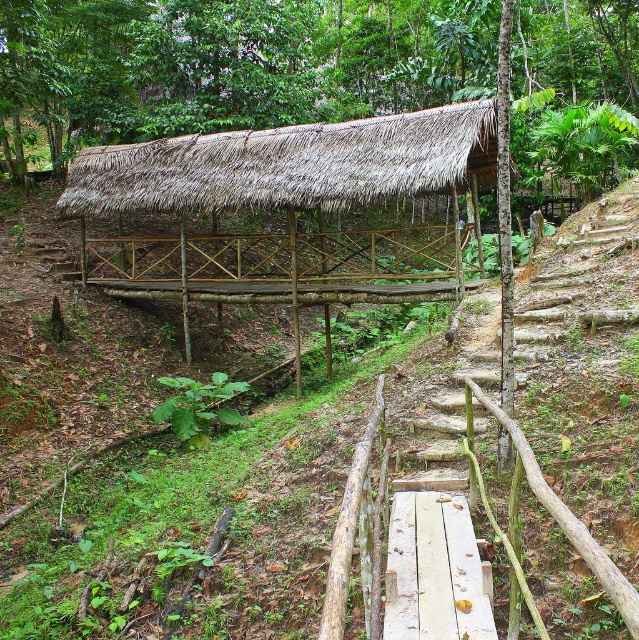
Can you confirm if thatched roof hut at upper center is taller than thatched roof shelter at center?

Correct, thatched roof hut at upper center is much taller as thatched roof shelter at center.

Is point (344, 8) positioned before point (252, 132)?

No.

Between point (107, 99) and point (435, 179), which one is positioned in front?

Point (435, 179) is in front.

Locate an element on the screen. Image resolution: width=639 pixels, height=640 pixels. thatched roof hut at upper center is located at coordinates (233, 64).